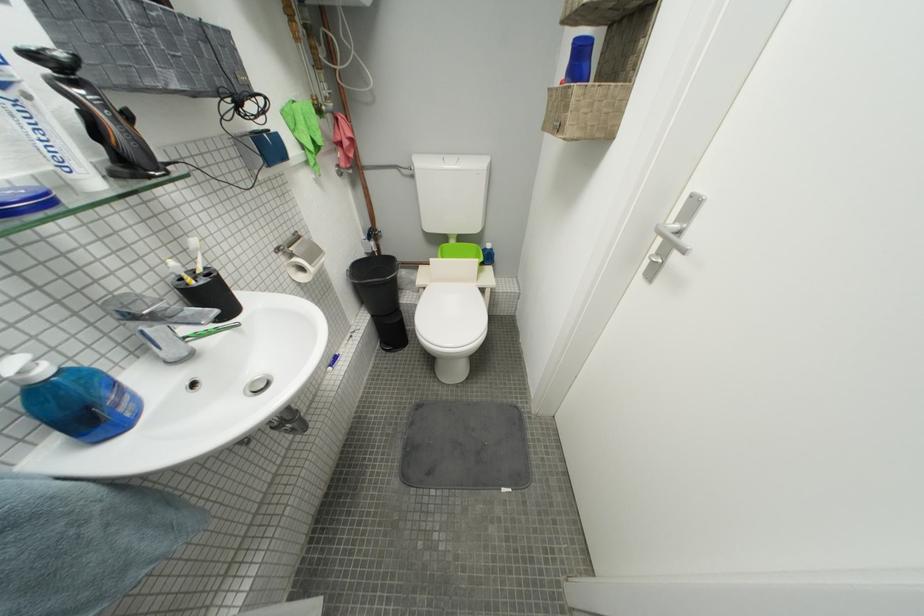
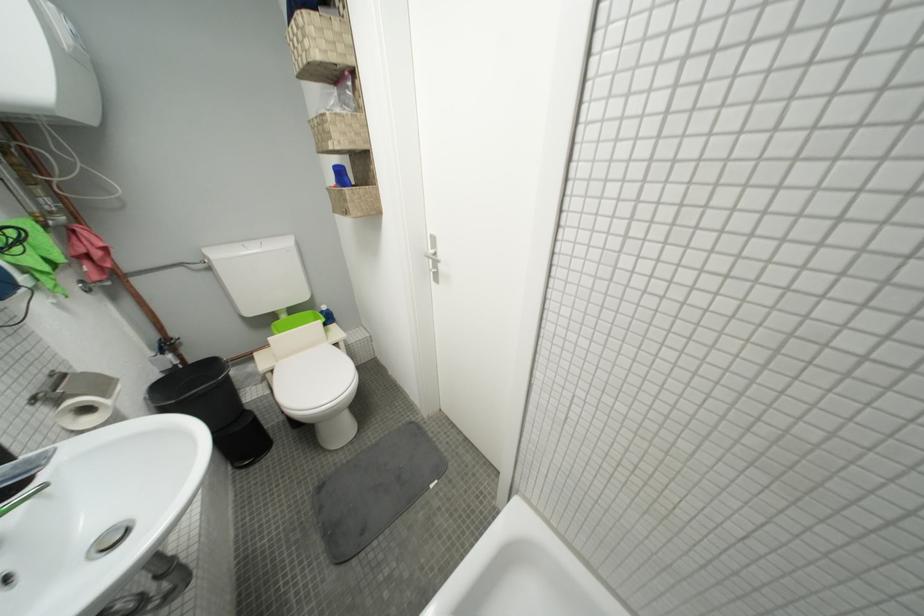
The point at (433, 291) is marked in the first image. Where is the corresponding point in the second image?

(281, 373)